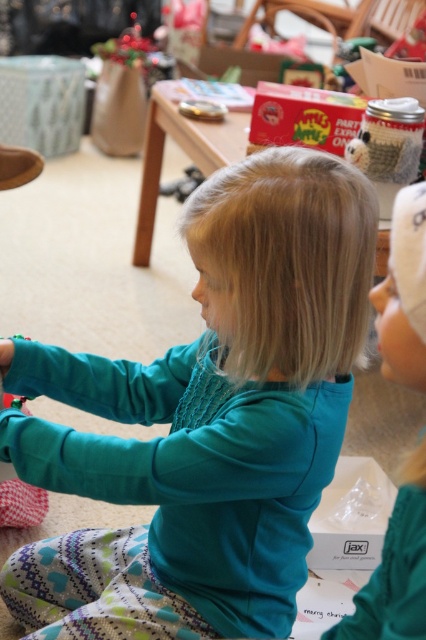
Question: Can you confirm if teal soft shirt at center is positioned above teal fabric toddler at center?

Choices:
 (A) yes
 (B) no

Answer: (B)

Question: Where is teal soft shirt at center located in relation to teal fabric toddler at center in the image?

Choices:
 (A) below
 (B) above

Answer: (A)

Question: Among these points, which one is farthest from the camera?

Choices:
 (A) (71, 540)
 (B) (411, 602)

Answer: (A)

Question: Which object is farther from the camera taking this photo?

Choices:
 (A) teal fabric toddler at center
 (B) teal soft shirt at center

Answer: (B)

Question: Where is teal soft shirt at center located in relation to teal fabric toddler at center in the image?

Choices:
 (A) above
 (B) below

Answer: (B)